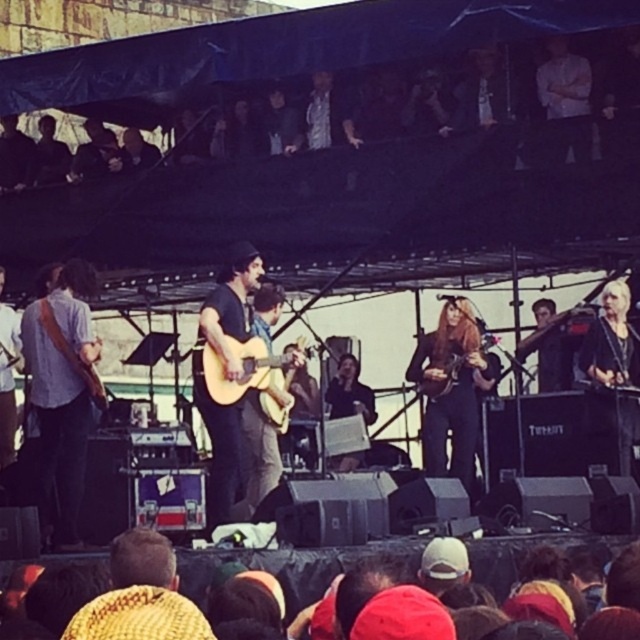
Is light brown acoustic guitar at center above wooden acoustic guitar at center?

Indeed, light brown acoustic guitar at center is positioned over wooden acoustic guitar at center.

Does light brown acoustic guitar at center have a smaller size compared to wooden acoustic guitar at center?

Incorrect, light brown acoustic guitar at center is not smaller in size than wooden acoustic guitar at center.

Locate an element on the screen. light brown acoustic guitar at center is located at coordinates (248, 376).